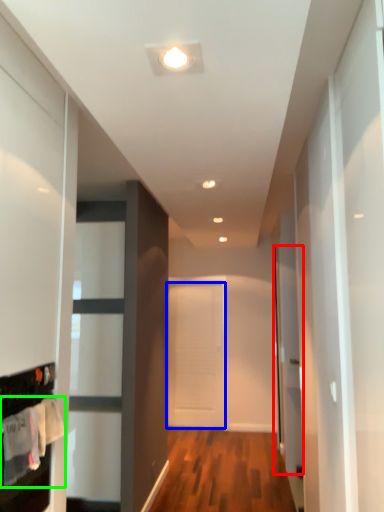
Question: Based on their relative distances, which object is farther from glass door (highlighted by a red box)? Choose from door (highlighted by a blue box) and laundry (highlighted by a green box).

Choices:
 (A) door
 (B) laundry

Answer: (B)